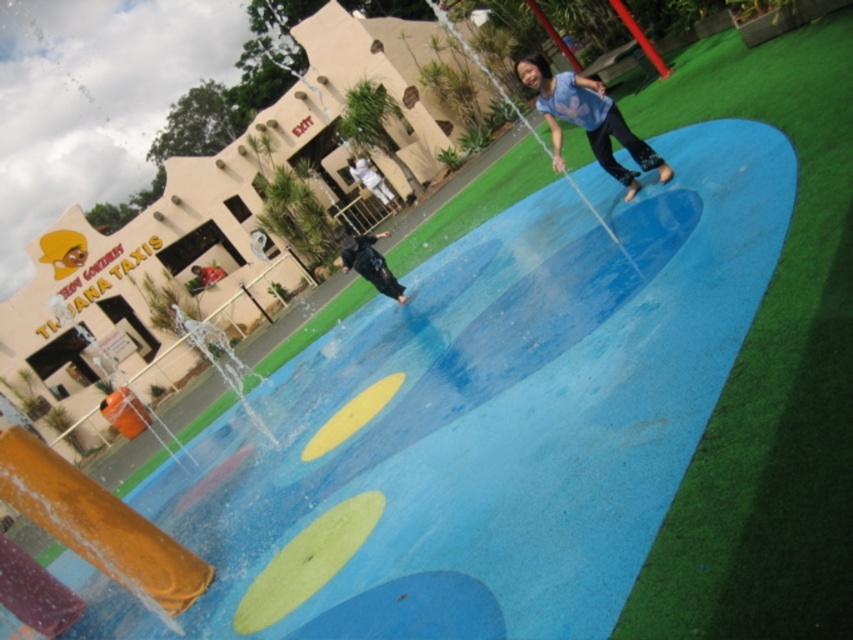
Question: Which point is closer to the camera taking this photo?

Choices:
 (A) (358, 244)
 (B) (352, 168)
 (C) (584, 97)

Answer: (C)

Question: Which object is closer to the camera taking this photo?

Choices:
 (A) blue matte shirt at upper center
 (B) dark blue fabric shirt at center

Answer: (A)

Question: Which object is positioned closest to the black matte pants at center?

Choices:
 (A) blue matte shirt at upper center
 (B) dark blue fabric shirt at center

Answer: (A)

Question: Does blue matte shirt at upper center have a greater width compared to black matte pants at center?

Choices:
 (A) no
 (B) yes

Answer: (B)

Question: Is black matte pants at center wider than dark blue fabric shirt at center?

Choices:
 (A) yes
 (B) no

Answer: (B)

Question: Is blue matte shirt at upper center above dark blue fabric shirt at center?

Choices:
 (A) no
 (B) yes

Answer: (A)